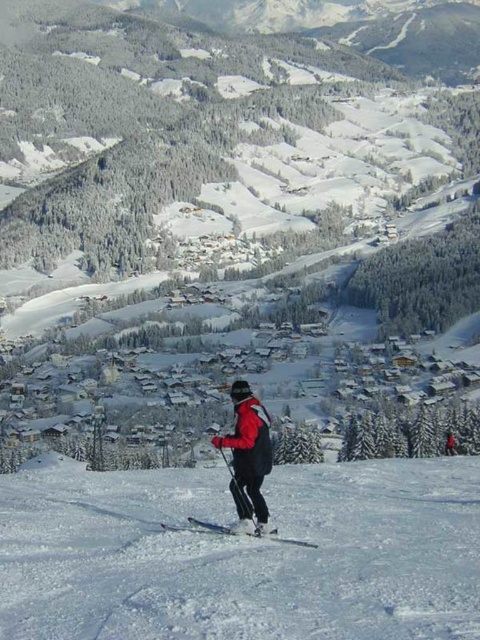
Who is positioned more to the left, red matte jacket at center or white plastic ski at center?

From the viewer's perspective, red matte jacket at center appears more on the left side.

Which of these two, red matte jacket at center or white plastic ski at center, stands taller?

red matte jacket at center

This screenshot has width=480, height=640. I want to click on red matte jacket at center, so click(x=248, y=452).

Where is `red matte jacket at center`? red matte jacket at center is located at coordinates (248, 452).

Who is lower down, white snow ski slope at center or red matte jacket at center?

Positioned lower is white snow ski slope at center.

Image resolution: width=480 pixels, height=640 pixels. What do you see at coordinates (242, 554) in the screenshot? I see `white snow ski slope at center` at bounding box center [242, 554].

Does point (168, 554) lie behind point (263, 438)?

No.

Identify the location of white snow ski slope at center. This screenshot has width=480, height=640. (242, 554).

Does white snow ski slope at center have a larger size compared to white plastic ski at center?

Yes.

Who is taller, white snow ski slope at center or white plastic ski at center?

white snow ski slope at center

Describe the element at coordinates (242, 554) in the screenshot. I see `white snow ski slope at center` at that location.

This screenshot has height=640, width=480. In order to click on white snow ski slope at center in this screenshot , I will do tap(242, 554).